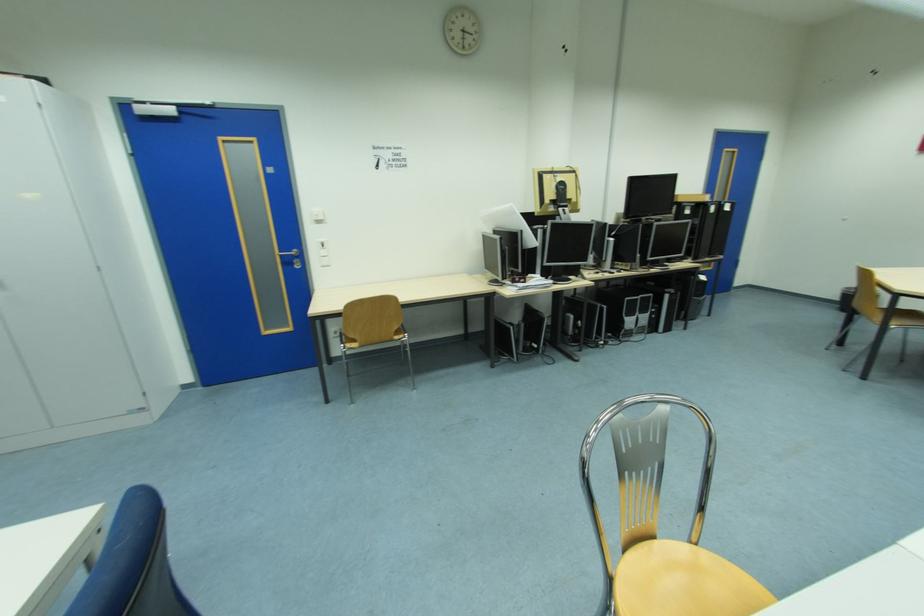
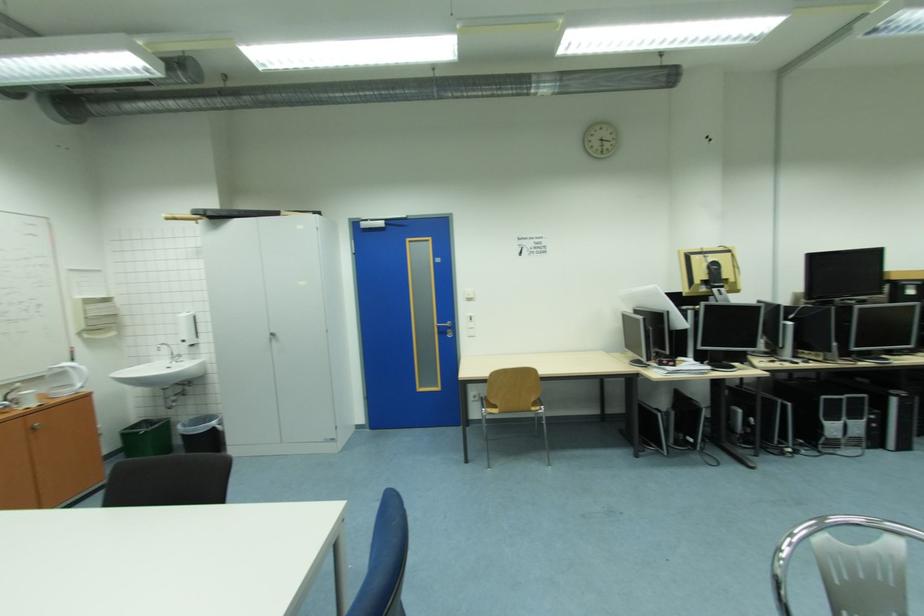
Locate, in the second image, the point that corresponds to the point at 675,297 in the first image.

(901, 400)